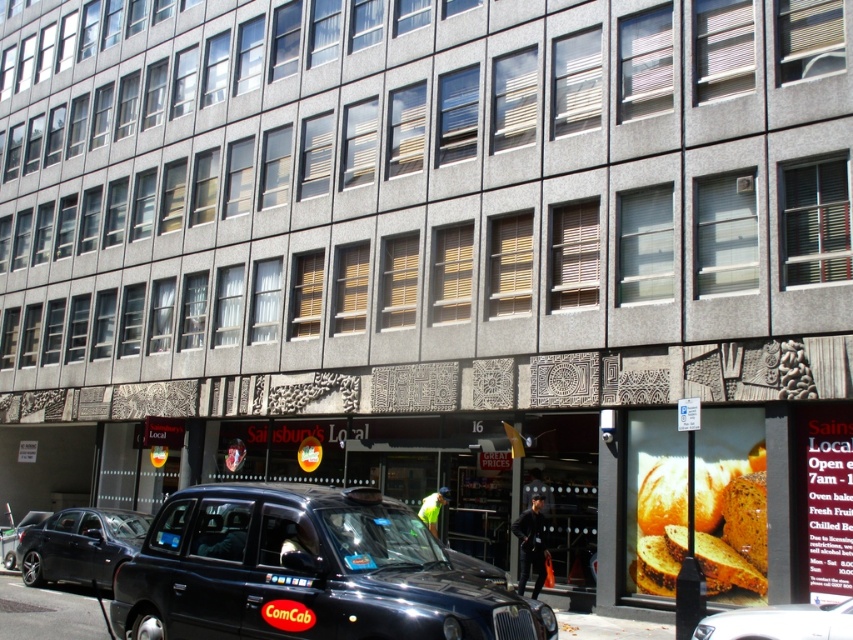
Question: Is shiny black taxi at lower left positioned in front of white matte car at lower center?

Choices:
 (A) no
 (B) yes

Answer: (A)

Question: Which point appears closest to the camera in this image?

Choices:
 (A) (73, 557)
 (B) (722, 612)
 (C) (10, 563)
 (D) (398, 636)

Answer: (D)

Question: Which object is farther from the camera taking this photo?

Choices:
 (A) black plastic license plate at center
 (B) shiny black taxi at center
 (C) white matte car at lower center

Answer: (A)

Question: Which object appears closest to the camera in this image?

Choices:
 (A) metallic silver car at lower left
 (B) shiny black taxi at center
 (C) black plastic license plate at center

Answer: (B)

Question: Does shiny black taxi at lower left appear under metallic silver car at lower left?

Choices:
 (A) no
 (B) yes

Answer: (A)

Question: Is shiny black taxi at lower left thinner than metallic silver car at lower left?

Choices:
 (A) yes
 (B) no

Answer: (A)